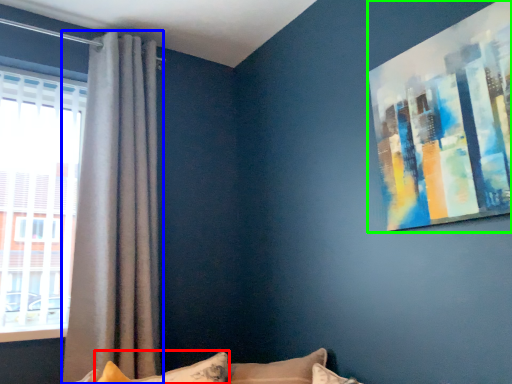
Question: Which is nearer to the pillow (highlighted by a red box)? curtain (highlighted by a blue box) or picture frame (highlighted by a green box).

Choices:
 (A) curtain
 (B) picture frame

Answer: (A)